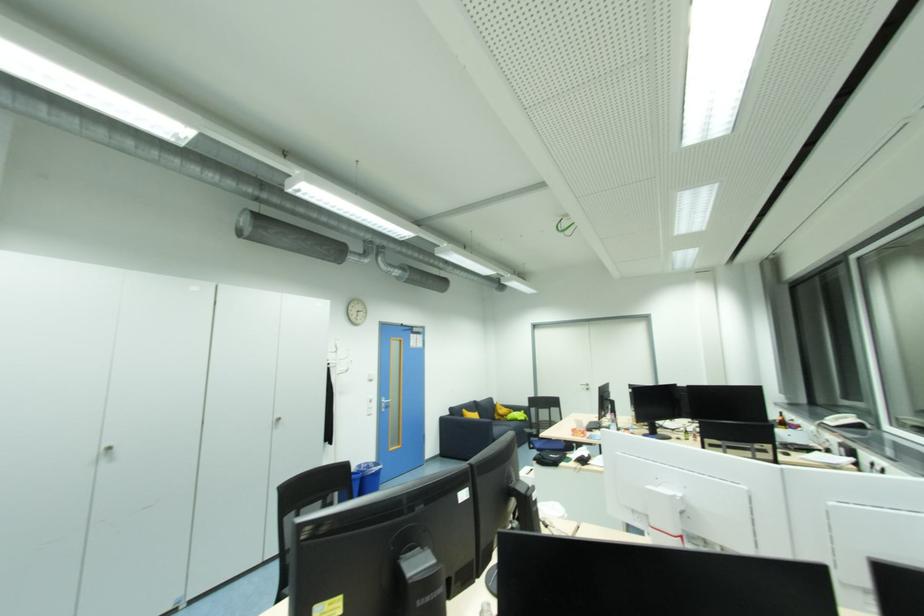
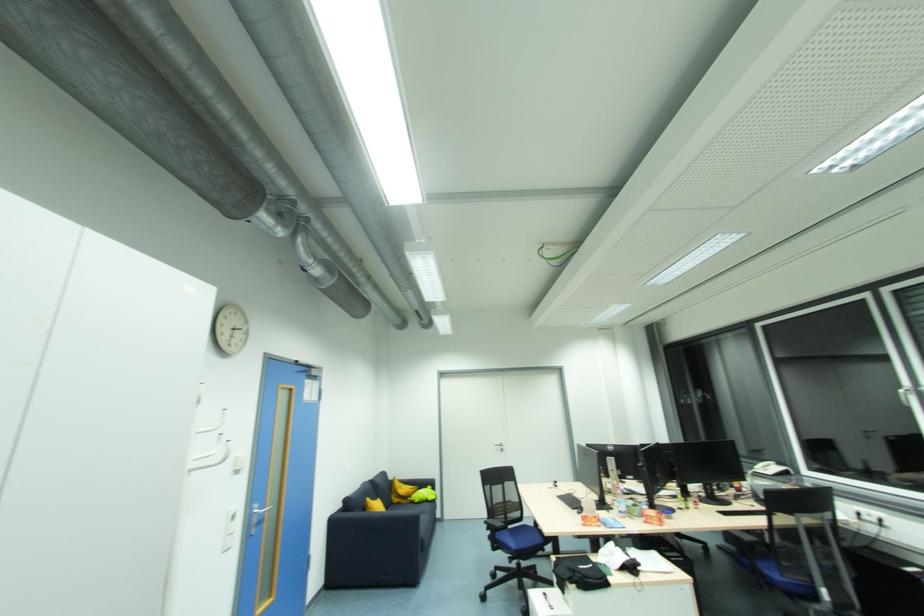
Find the pixel in the second image that matches point (503, 421) in the first image.

(400, 505)